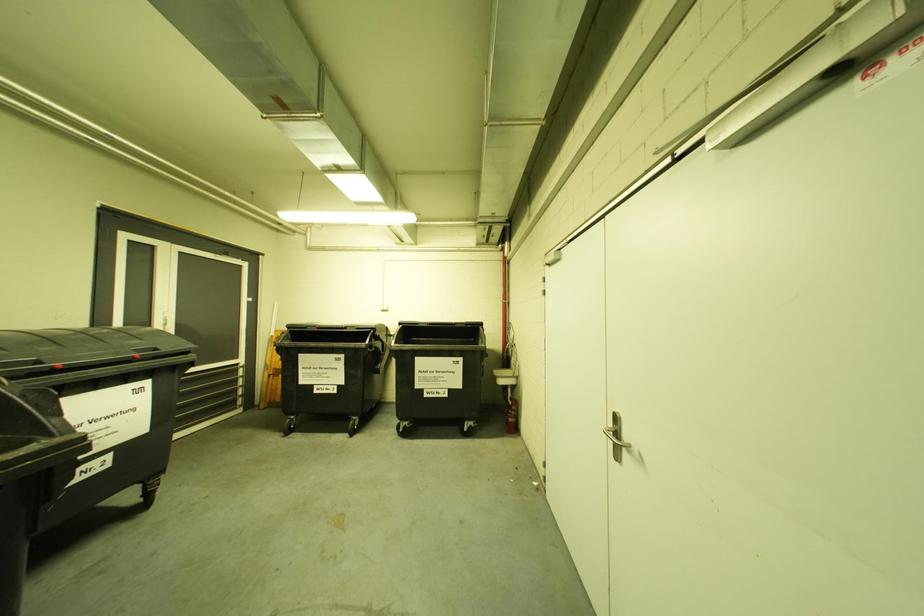
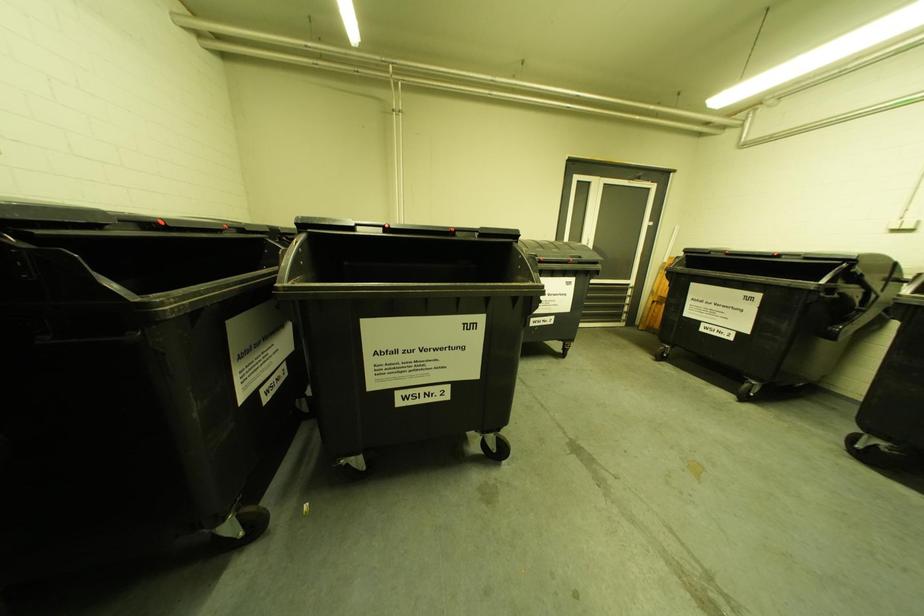
The images are taken continuously from a first-person perspective. In which direction is your viewpoint rotating?

The camera's rotation is toward left-down.